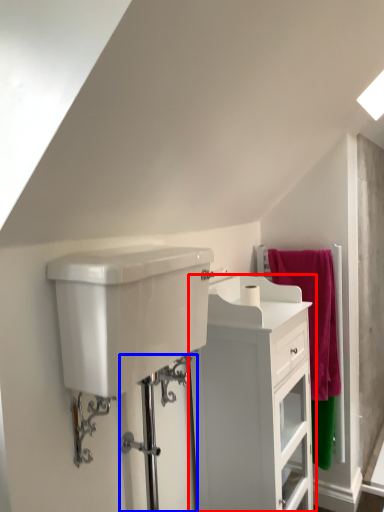
Question: Which point is further to the camera, bathroom cabinet (highlighted by a red box) or shower door (highlighted by a blue box)?

Choices:
 (A) bathroom cabinet
 (B) shower door

Answer: (A)